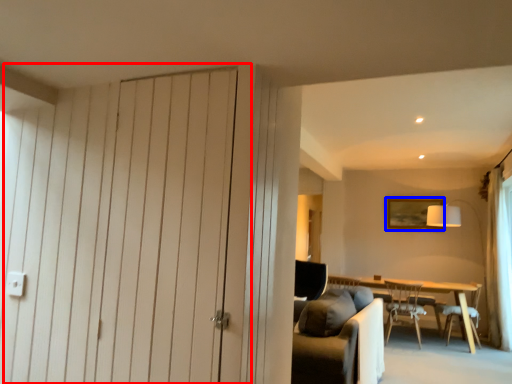
Question: Which object appears farthest to the camera in this image, door (highlighted by a red box) or picture frame (highlighted by a blue box)?

Choices:
 (A) door
 (B) picture frame

Answer: (B)